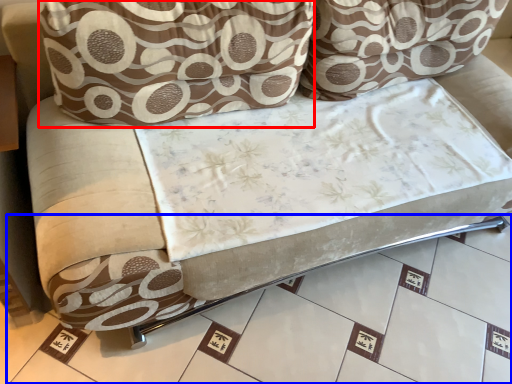
Question: Among these objects, which one is farthest to the camera, throw pillow (highlighted by a red box) or tile (highlighted by a blue box)?

Choices:
 (A) throw pillow
 (B) tile

Answer: (A)